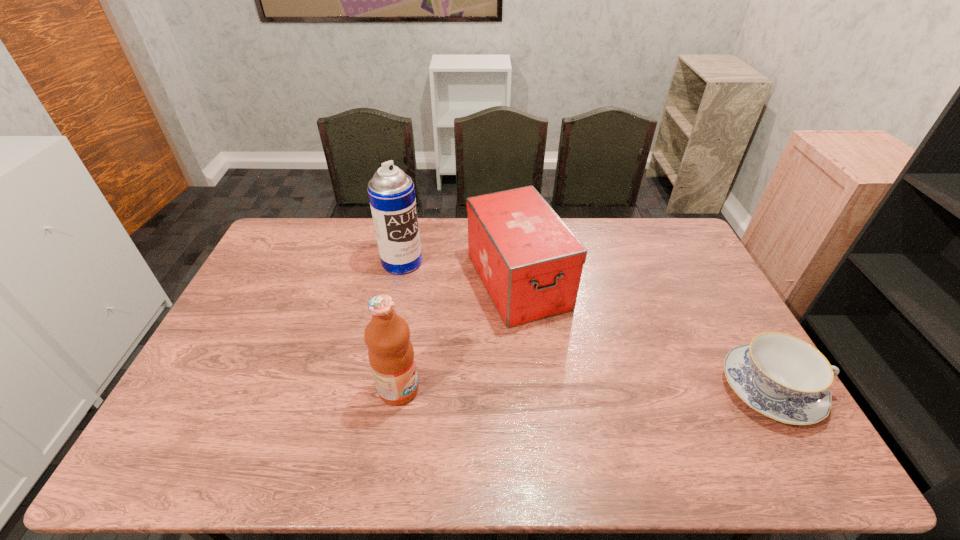
Identify the location of vacant space at the near edge of the desktop. (412, 413).

The image size is (960, 540). In order to click on vacant space at the left edge in this screenshot , I will do `click(273, 285)`.

Identify the location of vacant area at the right edge. (665, 285).

What are the coordinates of `free spot at the far left corner of the desktop` in the screenshot? It's located at (307, 249).

In the image, there is a desktop. Find the location of `vacant space at the far right corner`. vacant space at the far right corner is located at coordinates (681, 254).

Where is `free point between the third tallest object and the rightmost object`? The width and height of the screenshot is (960, 540). free point between the third tallest object and the rightmost object is located at coordinates (645, 335).

Identify the location of free spot between the third tallest object and the tallest object. (460, 272).

This screenshot has width=960, height=540. I want to click on free point between the first-aid kit and the tallest object, so click(460, 272).

At what (x,y) coordinates should I click in order to perform the action: click on free spot between the aerosol can and the third object from left to right. Please return your answer as a coordinate pair (x, y). Looking at the image, I should click on point(460,272).

The image size is (960, 540). What are the coordinates of `vacant point located between the shortest object and the third object from left to right` in the screenshot? It's located at (645, 335).